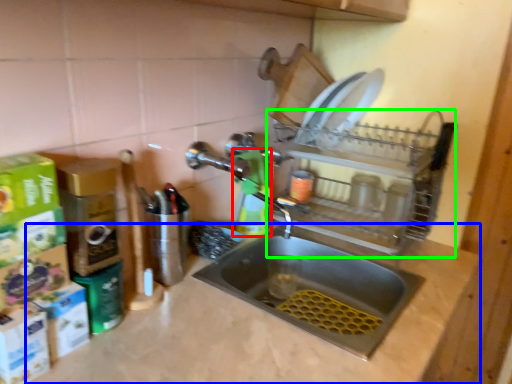
Question: Estimate the real-world distances between objects in this image. Which object is farther from cleaning product (highlighted by a red box), counter top (highlighted by a blue box) or appliance (highlighted by a green box)?

Choices:
 (A) counter top
 (B) appliance

Answer: (A)